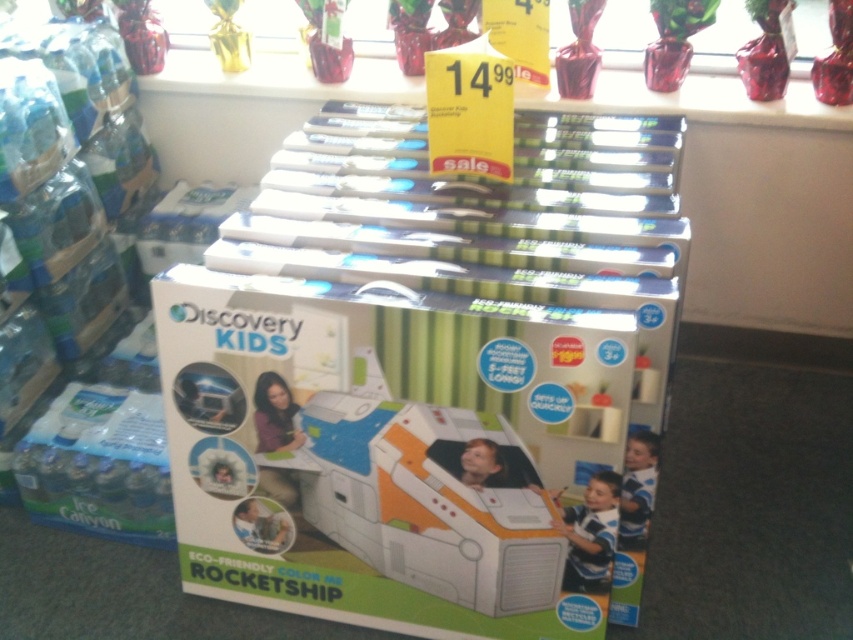
You are a customer in a store and want to pick up the blue striped shirt at lower right and the transparent glass vase at upper center. Which item can you grab first without moving from your current position?

The blue striped shirt at lower right is closer to the viewer than the transparent glass vase at upper center, so you can grab the blue striped shirt at lower right first without moving.

From the picture: You are a customer looking at the Discovery Kids eco friendly color me rocketship box in the foreground. There is a point marked at coordinates (637, 488). Can you tell me what object this point is located on?

The point marked at coordinates (637, 488) is located on the blue striped shirt at lower right.